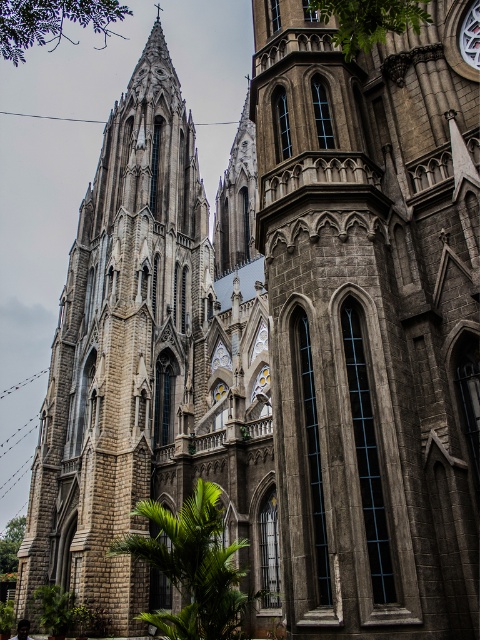
Question: Which point appears farthest from the camera in this image?

Choices:
 (A) (116, 611)
 (B) (280, 413)

Answer: (A)

Question: Can you confirm if gray stone tower at center is positioned below stone tower at left?

Choices:
 (A) yes
 (B) no

Answer: (A)

Question: From the image, what is the correct spatial relationship of gray stone tower at center in relation to stone tower at left?

Choices:
 (A) above
 (B) below

Answer: (B)

Question: Which of the following is the closest to the observer?

Choices:
 (A) (380, 563)
 (B) (158, 205)

Answer: (A)

Question: Does gray stone tower at center appear over stone tower at left?

Choices:
 (A) no
 (B) yes

Answer: (A)